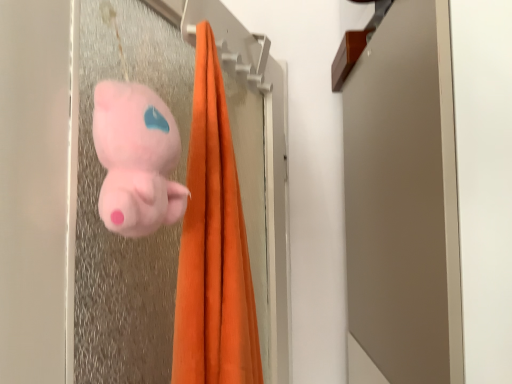
Question: Looking at the image, does matte plastic screen door at upper center seem bigger or smaller compared to fluffy pink plush at center?

Choices:
 (A) big
 (B) small

Answer: (A)

Question: Considering the positions of point (96, 54) and point (164, 150), is point (96, 54) closer or farther from the camera than point (164, 150)?

Choices:
 (A) farther
 (B) closer

Answer: (A)

Question: Considering the positions of matte plastic screen door at upper center and fluffy pink plush at center in the image, is matte plastic screen door at upper center taller or shorter than fluffy pink plush at center?

Choices:
 (A) tall
 (B) short

Answer: (A)

Question: From a real-world perspective, is fluffy pink plush at center physically located above or below matte plastic screen door at upper center?

Choices:
 (A) below
 (B) above

Answer: (B)

Question: Considering the positions of point (154, 185) and point (87, 294), is point (154, 185) closer or farther from the camera than point (87, 294)?

Choices:
 (A) farther
 (B) closer

Answer: (B)

Question: In terms of height, does fluffy pink plush at center look taller or shorter compared to matte plastic screen door at upper center?

Choices:
 (A) short
 (B) tall

Answer: (A)

Question: Considering the relative positions of fluffy pink plush at center and matte plastic screen door at upper center in the image provided, is fluffy pink plush at center to the left or to the right of matte plastic screen door at upper center?

Choices:
 (A) right
 (B) left

Answer: (B)